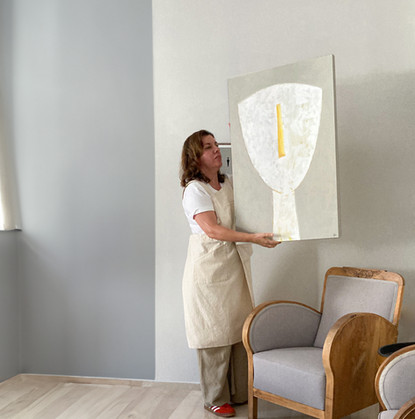
Image resolution: width=415 pixels, height=419 pixels. In order to click on wall in this screenshot , I will do `click(70, 166)`.